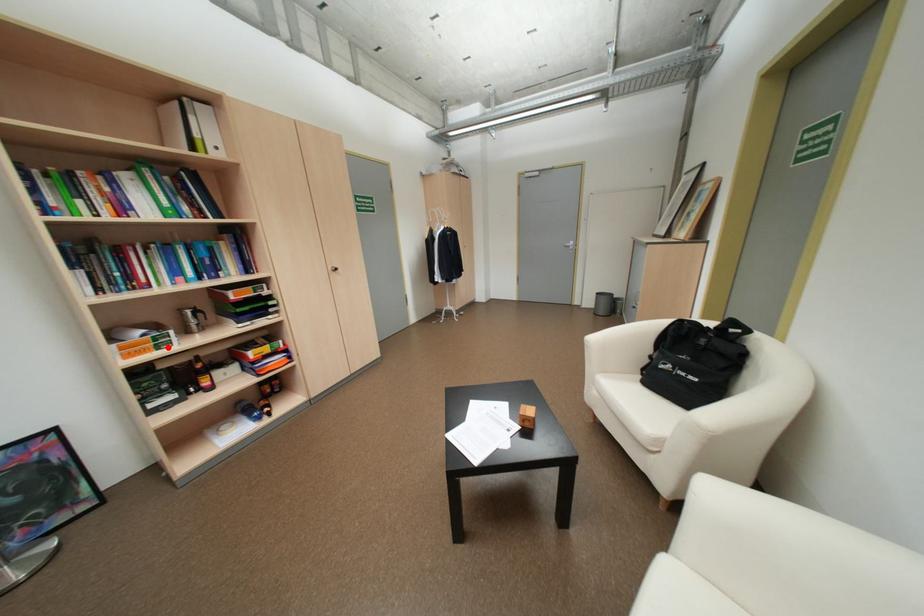
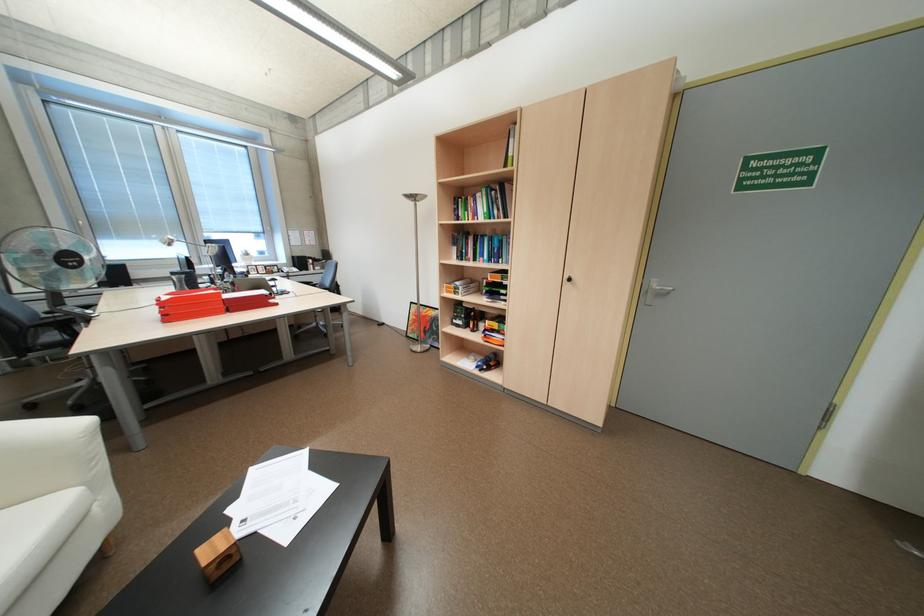
In the second image, find the point that corresponds to the highlighted location in the first image.

(465, 293)